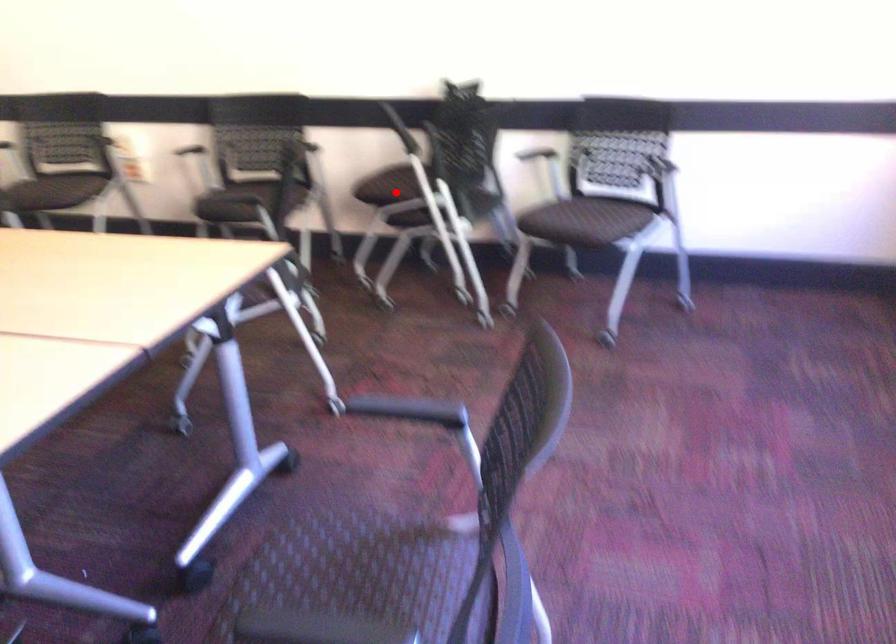
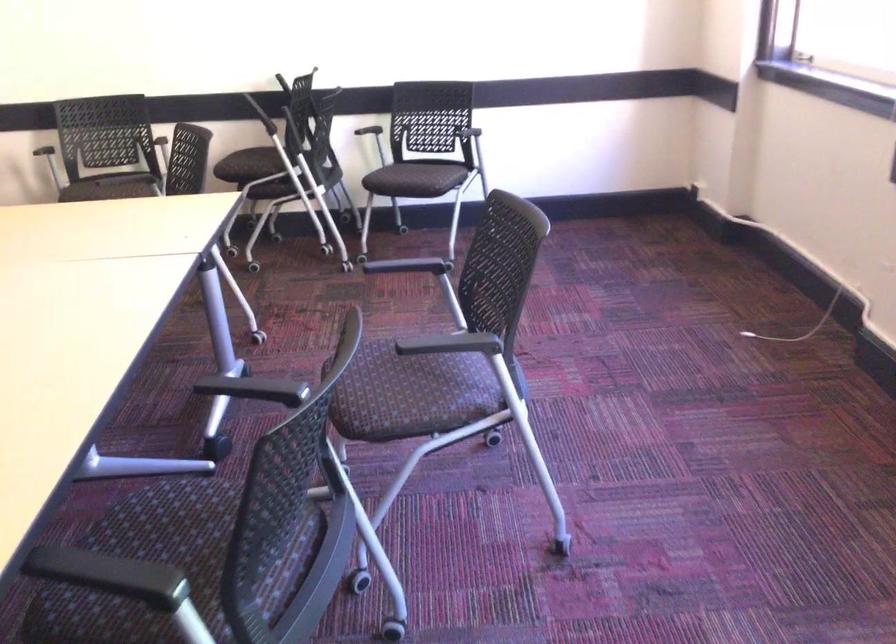
Question: I am providing you with two images of the same scene from different viewpoints. Image1 has a red point marked. In image2, the corresponding 3D location appears at what relative position? Reply with the corresponding letter.

Choices:
 (A) Closer
 (B) Farther

Answer: (B)